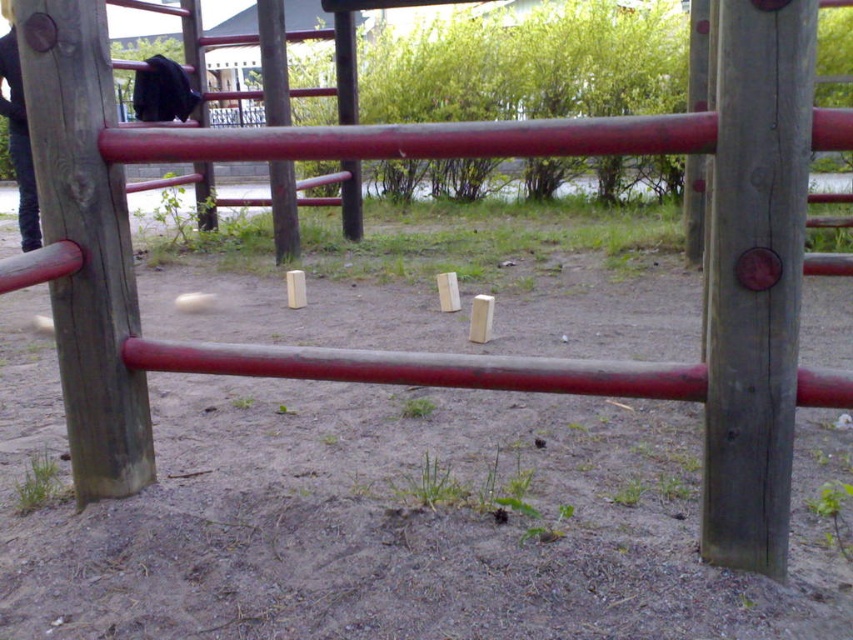
Question: Is wooden pole at left to the right of brushed wood pole at center from the viewer's perspective?

Choices:
 (A) yes
 (B) no

Answer: (B)

Question: Is smooth wood pole at center positioned in front of wooden pole at left?

Choices:
 (A) yes
 (B) no

Answer: (A)

Question: Considering the relative positions of smooth wood pole at center and wooden pole at center in the image provided, where is smooth wood pole at center located with respect to wooden pole at center?

Choices:
 (A) below
 (B) above

Answer: (A)

Question: Which object is positioned closest to the wooden pole at center?

Choices:
 (A) wooden pole at left
 (B) brushed wood pole at center
 (C) smooth wood pole at center

Answer: (B)

Question: Which point is closer to the camera?

Choices:
 (A) wooden pole at center
 (B) smooth wood pole at center

Answer: (B)

Question: Among these points, which one is nearest to the camera?

Choices:
 (A) (282, 241)
 (B) (88, 157)
 (C) (352, 221)

Answer: (B)